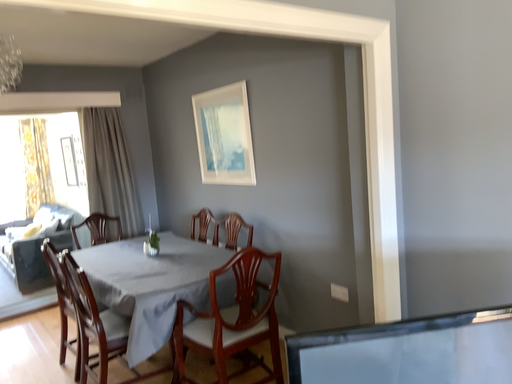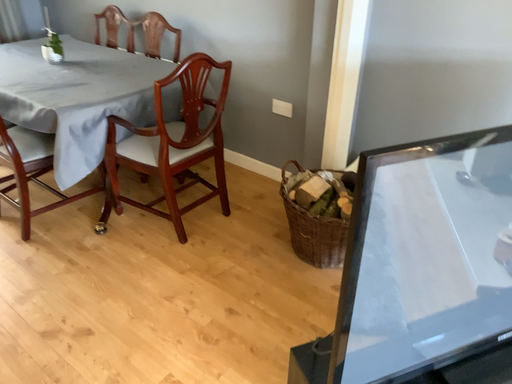
Question: How did the camera likely rotate when shooting the video?

Choices:
 (A) rotated downward
 (B) rotated upward

Answer: (A)